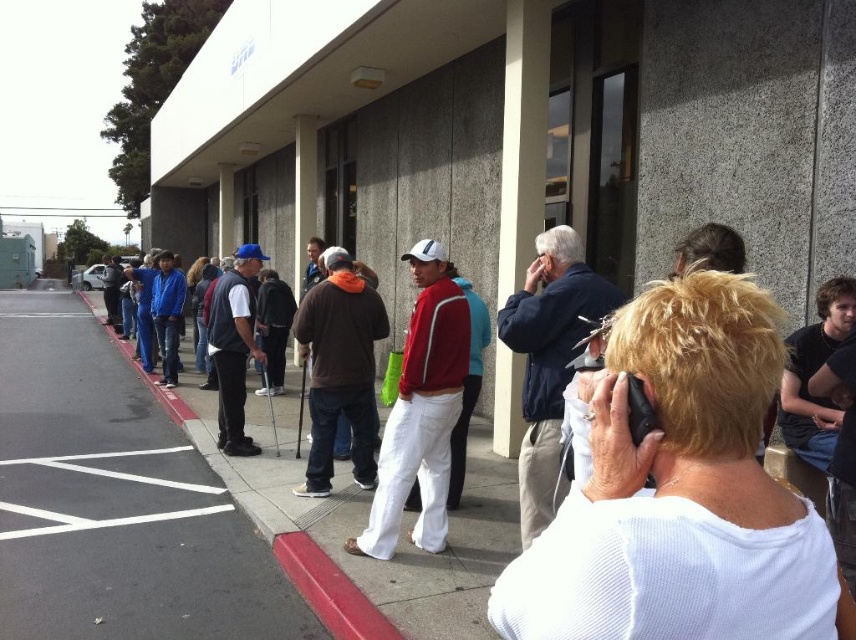
Which is more to the right, red rubber curb at lower center or white asphalt parking line at lower left?

red rubber curb at lower center

Does red rubber curb at lower center have a greater height compared to white asphalt parking line at lower left?

Indeed, red rubber curb at lower center has a greater height compared to white asphalt parking line at lower left.

Looking at this image, measure the distance between red rubber curb at lower center and camera.

red rubber curb at lower center and camera are 3.34 meters apart.

Identify the location of red rubber curb at lower center. This screenshot has height=640, width=856. (330, 589).

Describe the element at coordinates (550, 360) in the screenshot. Image resolution: width=856 pixels, height=640 pixels. I see `dark blue jacket at center` at that location.

Can you confirm if dark blue jacket at center is positioned above brown soft sweater at center?

Yes.

Find the location of a particular element. This screenshot has width=856, height=640. dark blue jacket at center is located at coordinates (550, 360).

Is white cotton shirt at center to the right of blue fabric baseball cap at center from the viewer's perspective?

In fact, white cotton shirt at center is to the left of blue fabric baseball cap at center.

Does point (218, 468) come behind point (238, 436)?

No, it is in front of (238, 436).

You are a GUI agent. You are given a task and a screenshot of the screen. Output one action in this format:
    pyautogui.click(x=<x>, y=<y>)
    Task: Click on the white cotton shirt at center
    
    Given the screenshot: What is the action you would take?
    pyautogui.click(x=239, y=470)